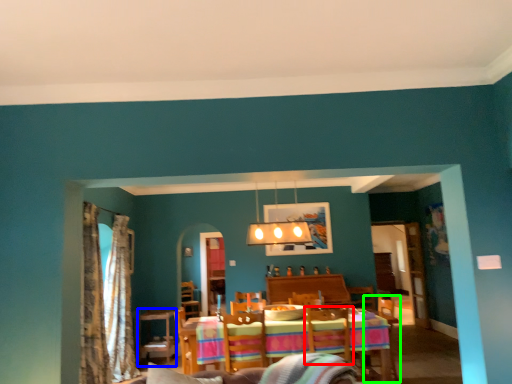
Question: Which object is positioned closest to swivel chair (highlighted by a red box)? Select from table (highlighted by a blue box) and armchair (highlighted by a green box).

Choices:
 (A) table
 (B) armchair

Answer: (A)